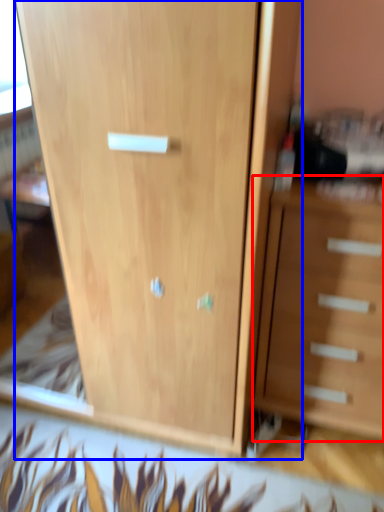
Question: Which object is further to the camera taking this photo, chest of drawers (highlighted by a red box) or cupboard (highlighted by a blue box)?

Choices:
 (A) chest of drawers
 (B) cupboard

Answer: (A)